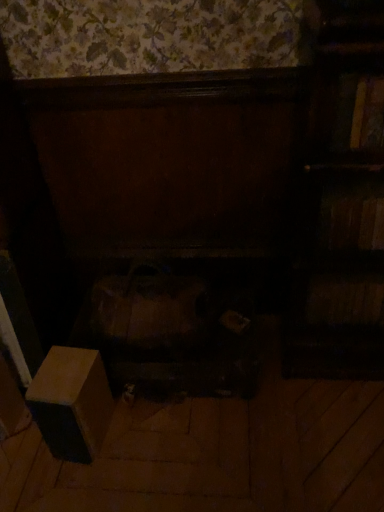
Where is `vacant area that is situated to the right of matte brown cardboard box at lower left`? vacant area that is situated to the right of matte brown cardboard box at lower left is located at coordinates (141, 435).